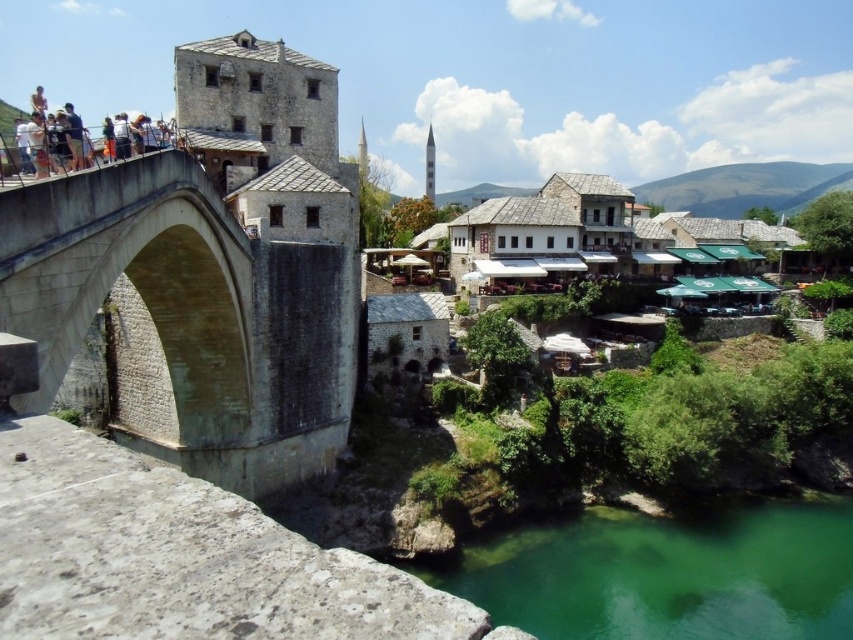
Question: Is green translucent water at lower center to the left of white stone tower at center from the viewer's perspective?

Choices:
 (A) no
 (B) yes

Answer: (A)

Question: Which point is farther to the camera?

Choices:
 (A) (790, 582)
 (B) (428, 132)

Answer: (B)

Question: Which is nearer to the green translucent water at lower center?

Choices:
 (A) white stone minaret at upper center
 (B) white stone tower at center
 (C) stone arch bridge at left

Answer: (C)

Question: In this image, where is stone arch bridge at left located relative to green translucent water at lower center?

Choices:
 (A) left
 (B) right

Answer: (A)

Question: Among these objects, which one is farthest from the camera?

Choices:
 (A) white stone minaret at upper center
 (B) stone arch bridge at left
 (C) white stone tower at center

Answer: (A)

Question: Can you confirm if stone arch bridge at left is wider than white stone tower at center?

Choices:
 (A) yes
 (B) no

Answer: (A)